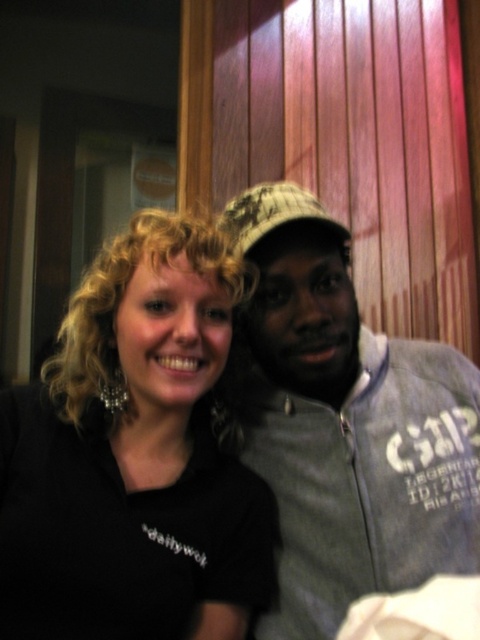
Question: Does black matte shirt at center have a smaller size compared to camouflage fabric baseball cap at center?

Choices:
 (A) yes
 (B) no

Answer: (B)

Question: Does gray cotton jacket at right appear on the right side of camouflage fabric baseball cap at center?

Choices:
 (A) no
 (B) yes

Answer: (B)

Question: Which object appears farthest from the camera in this image?

Choices:
 (A) gray cotton jacket at right
 (B) camouflage fabric baseball cap at center
 (C) black matte shirt at center

Answer: (B)

Question: Which point is farther to the camera?

Choices:
 (A) (324, 429)
 (B) (291, 221)

Answer: (A)

Question: Does black matte shirt at center appear on the right side of camouflage fabric baseball cap at center?

Choices:
 (A) yes
 (B) no

Answer: (B)

Question: Which point is farther to the camera?

Choices:
 (A) gray cotton jacket at right
 (B) camouflage fabric baseball cap at center

Answer: (B)